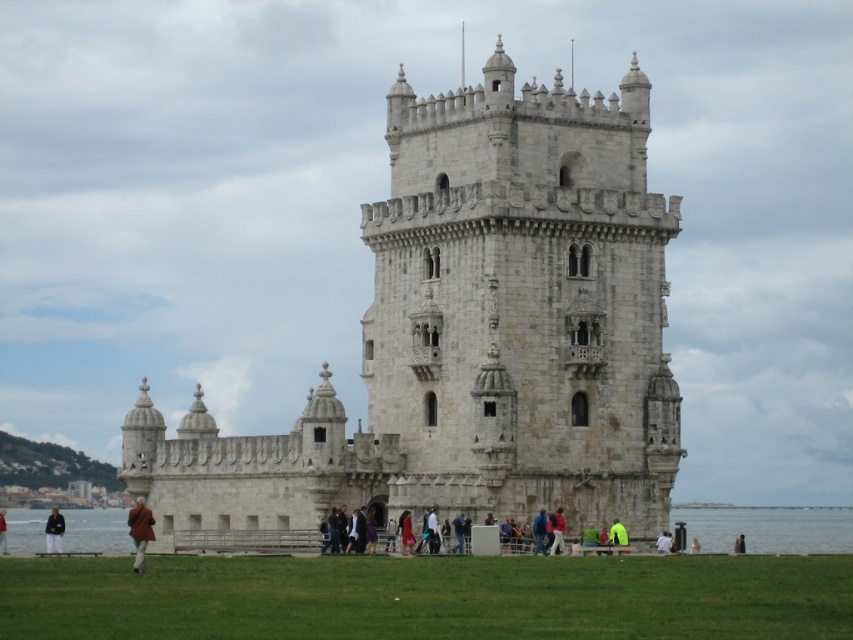
In the scene shown: Measure the distance between red fabric jacket at center and camera.

They are 85.90 meters apart.

Is point (561, 547) positioned after point (543, 509)?

No, it is not.

The image size is (853, 640). Identify the location of red fabric jacket at center. (556, 532).

Which is behind, point (86, 524) or point (132, 516)?

Positioned behind is point (86, 524).

Does clear water at lower center appear under brown wool coat at lower left?

Yes.

Who is more distant from viewer, (833, 524) or (144, 531)?

Point (833, 524)

Locate an element on the screen. clear water at lower center is located at coordinates pyautogui.click(x=770, y=529).

Between blue fabric jacket at center and brown leather jacket at lower left, which one is positioned lower?

brown leather jacket at lower left is lower down.

Who is taller, blue fabric jacket at center or brown leather jacket at lower left?

brown leather jacket at lower left is taller.

What do you see at coordinates (538, 532) in the screenshot?
I see `blue fabric jacket at center` at bounding box center [538, 532].

Where is `blue fabric jacket at center`? The width and height of the screenshot is (853, 640). blue fabric jacket at center is located at coordinates 538,532.